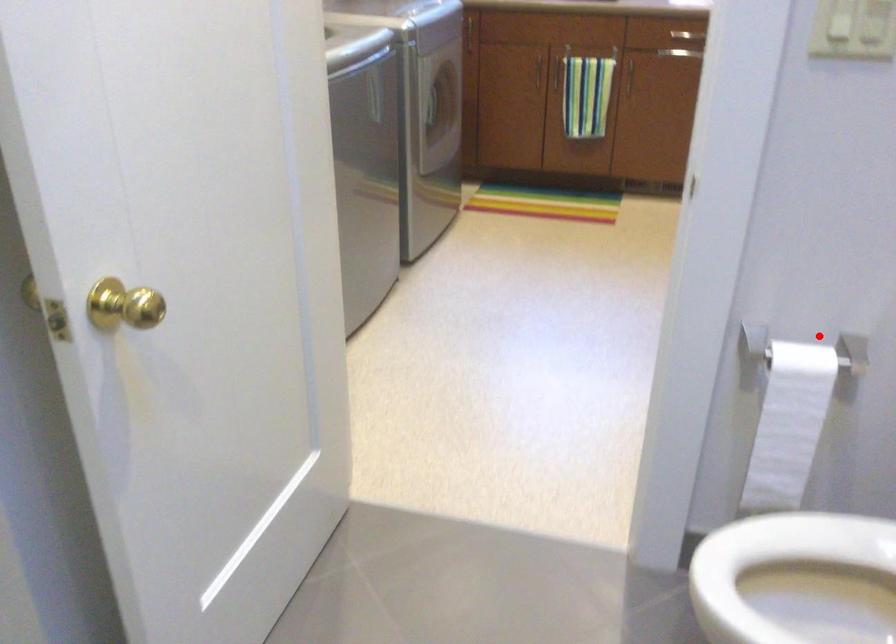
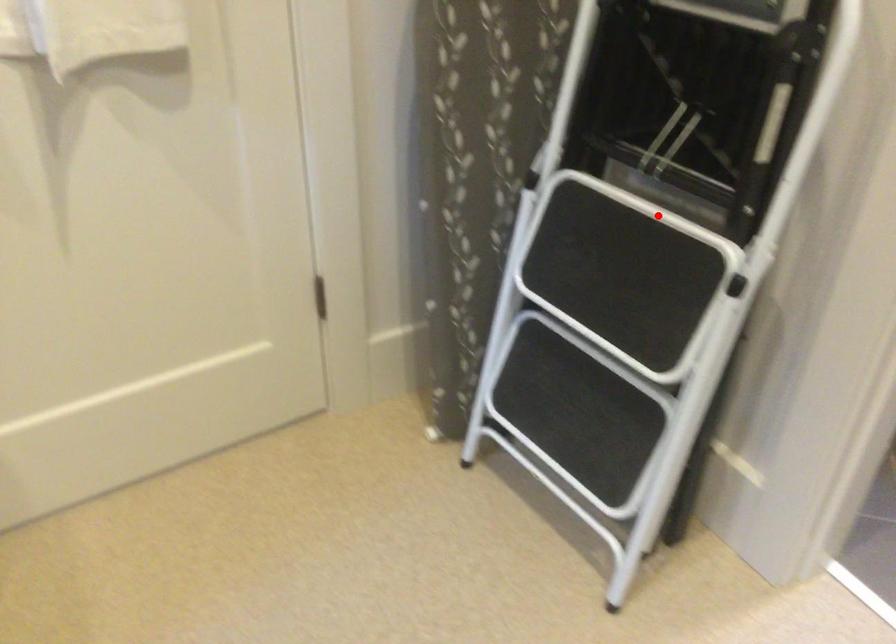
I am providing you with two images of the same scene from different viewpoints. A red point is marked on the first image and another point is marked on the second image. Are the points marked in image1 and image2 representing the same 3D position?

No